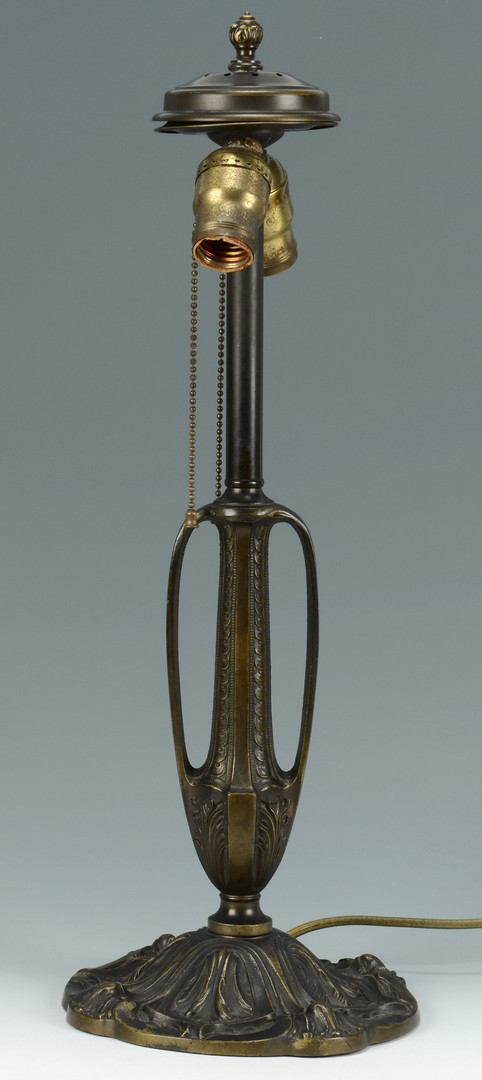
I want to click on wall, so click(x=70, y=853).